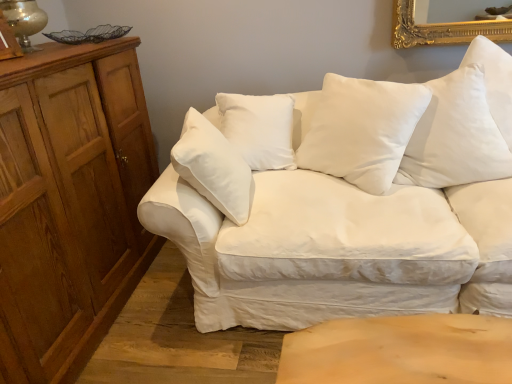
Question: Is white soft cushion at center, which is counted as the 2th pillow, starting from the right, taller than wooden dresser at left?

Choices:
 (A) no
 (B) yes

Answer: (A)

Question: Is white soft cushion at center, arranged as the first pillow when viewed from the left, smaller than wooden dresser at left?

Choices:
 (A) yes
 (B) no

Answer: (A)

Question: Is white soft cushion at center, arranged as the first pillow when viewed from the left, positioned with its back to wooden dresser at left?

Choices:
 (A) no
 (B) yes

Answer: (A)

Question: Is wooden dresser at left surrounded by white soft cushion at center, which is counted as the 2th pillow, starting from the right?

Choices:
 (A) yes
 (B) no

Answer: (B)

Question: Does white soft cushion at center, arranged as the first pillow when viewed from the left, have a lesser width compared to wooden dresser at left?

Choices:
 (A) yes
 (B) no

Answer: (A)

Question: From their relative heights in the image, would you say white cotton pillow at upper right, marked as the first pillow in a right-to-left arrangement, is taller or shorter than matte gold table lamp at upper left?

Choices:
 (A) short
 (B) tall

Answer: (B)

Question: From the image's perspective, relative to matte gold table lamp at upper left, is white cotton pillow at upper right, the 2th pillow when ordered from left to right, above or below?

Choices:
 (A) above
 (B) below

Answer: (B)

Question: Based on their positions, is white cotton pillow at upper right, the 2th pillow when ordered from left to right, located to the left or right of matte gold table lamp at upper left?

Choices:
 (A) right
 (B) left

Answer: (A)

Question: From a real-world perspective, is white cotton pillow at upper right, marked as the first pillow in a right-to-left arrangement, physically located above or below matte gold table lamp at upper left?

Choices:
 (A) above
 (B) below

Answer: (B)

Question: From a real-world perspective, is white soft cushion at center, which is counted as the 2th pillow, starting from the right, above or below matte gold table lamp at upper left?

Choices:
 (A) below
 (B) above

Answer: (A)

Question: In terms of height, does white soft cushion at center, arranged as the first pillow when viewed from the left, look taller or shorter compared to matte gold table lamp at upper left?

Choices:
 (A) tall
 (B) short

Answer: (A)

Question: From the image's perspective, is white soft cushion at center, which is counted as the 2th pillow, starting from the right, above or below matte gold table lamp at upper left?

Choices:
 (A) above
 (B) below

Answer: (B)

Question: Is white soft cushion at center, arranged as the first pillow when viewed from the left, to the left or to the right of matte gold table lamp at upper left in the image?

Choices:
 (A) right
 (B) left

Answer: (A)

Question: Considering their positions, is matte gold table lamp at upper left located in front of or behind white cotton couch at center?

Choices:
 (A) behind
 (B) front

Answer: (A)

Question: Is matte gold table lamp at upper left to the left or to the right of white cotton couch at center in the image?

Choices:
 (A) left
 (B) right

Answer: (A)